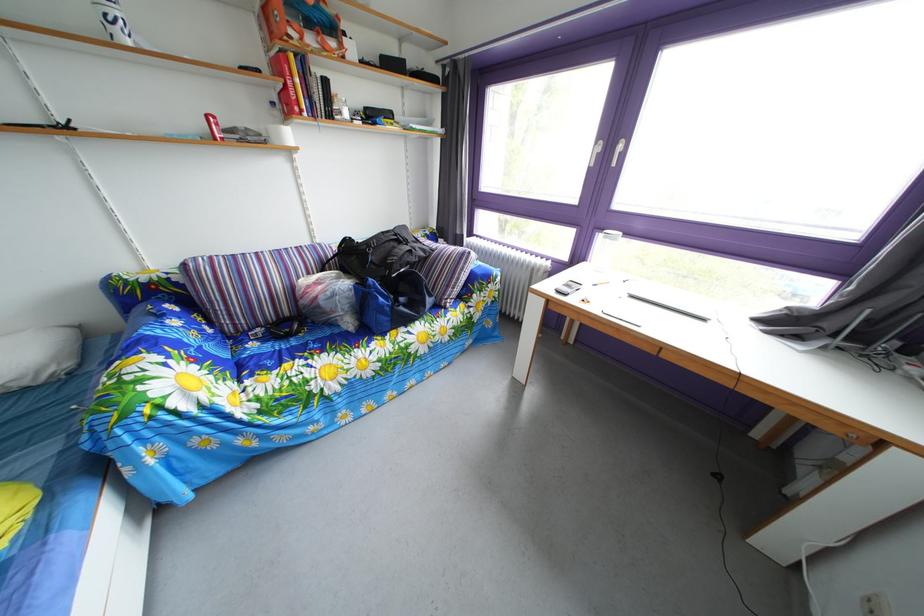
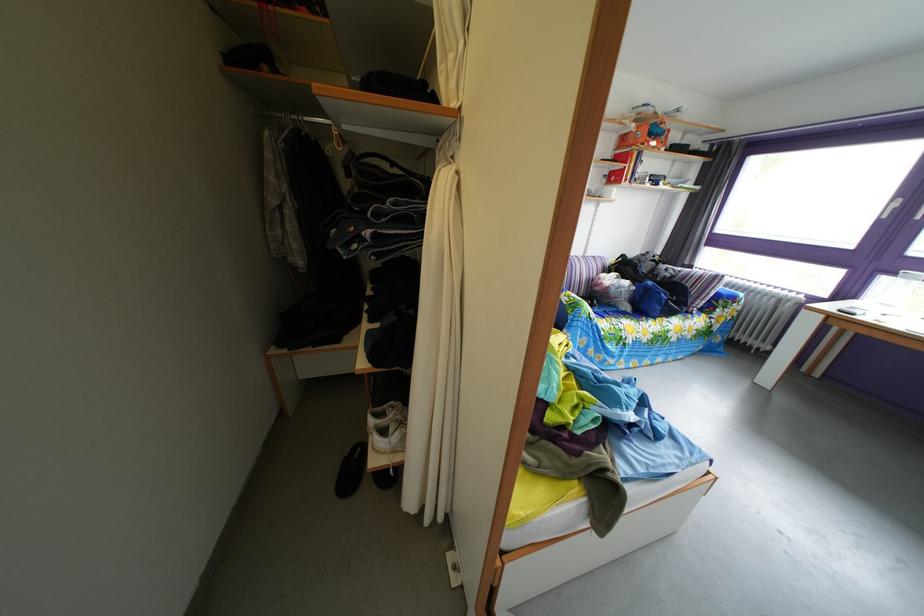
Find the pixel in the second image that matches (320,33) in the first image.

(661, 144)